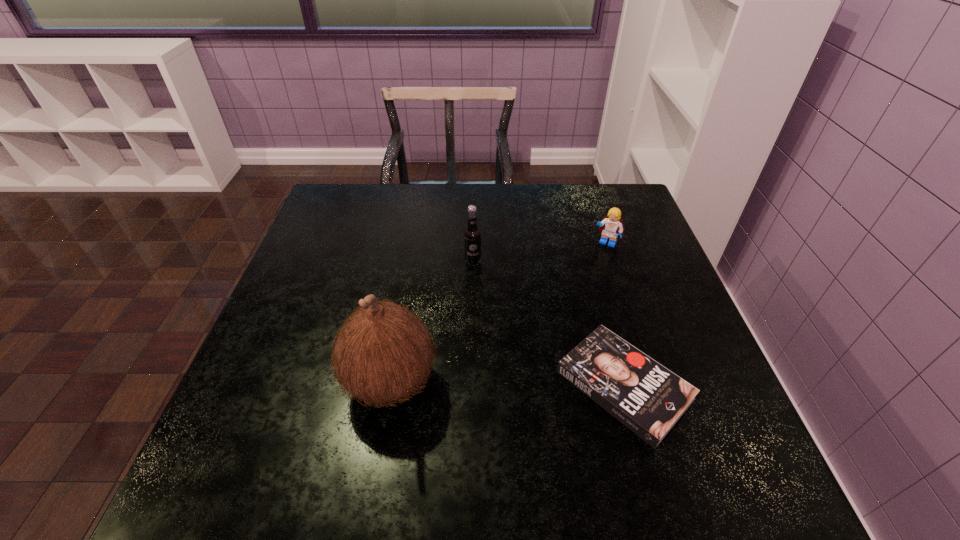
You are a GUI agent. You are given a task and a screenshot of the screen. Output one action in this format:
    pyautogui.click(x=<x>, y=<y>)
    Task: Click on the vacant area in the image that satisfies the following two spatial constraints: 1. on the back side of the farthest object; 2. on the right side of the second object from left to right
    This screenshot has width=960, height=540.
    Given the screenshot: What is the action you would take?
    pyautogui.click(x=473, y=243)

Identify the location of free point that satisfies the following two spatial constraints: 1. on the back side of the second tallest object; 2. on the left side of the farthest object. (473, 243).